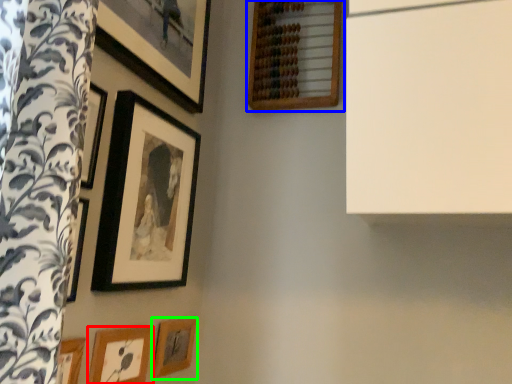
Question: Based on their relative distances, which object is nearer to picture frame (highlighted by a red box)? Choose from picture frame (highlighted by a blue box) and picture frame (highlighted by a green box).

Choices:
 (A) picture frame
 (B) picture frame

Answer: (B)